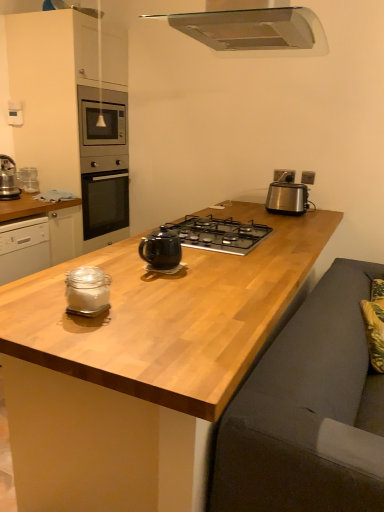
I want to click on vacant space in front of black glossy teapot at center, so click(164, 282).